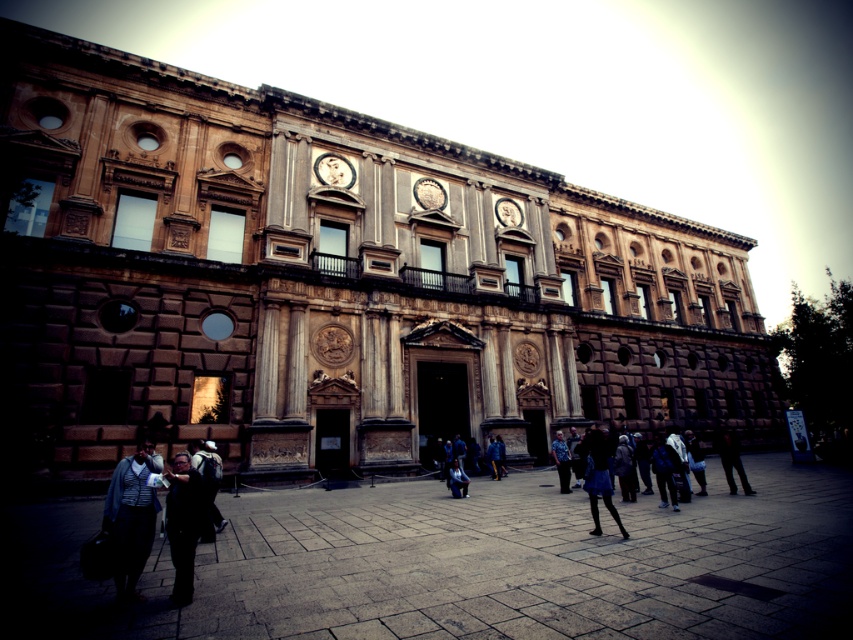
Question: Among these points, which one is farthest from the camera?

Choices:
 (A) (329, 161)
 (B) (492, 442)
 (C) (216, 486)

Answer: (A)

Question: Among these points, which one is farthest from the camera?

Choices:
 (A) (595, 481)
 (B) (569, 452)
 (C) (718, 445)

Answer: (B)

Question: Is the position of blue denim skirt at lower center less distant than that of gold metallic clock at upper center?

Choices:
 (A) no
 (B) yes

Answer: (B)

Question: Considering the relative positions of brown stone building at center and dark blue jeans at lower right in the image provided, where is brown stone building at center located with respect to dark blue jeans at lower right?

Choices:
 (A) right
 (B) left

Answer: (B)

Question: Which point is farther from the camera taking this photo?

Choices:
 (A) (595, 481)
 (B) (498, 468)

Answer: (B)

Question: Is dark gray suit at lower left smaller than dark blue jeans at lower right?

Choices:
 (A) no
 (B) yes

Answer: (B)